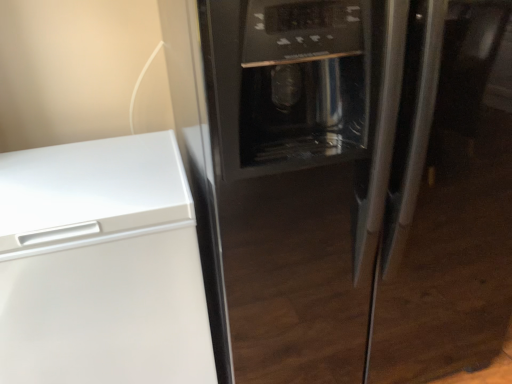
You are a GUI agent. You are given a task and a screenshot of the screen. Output one action in this format:
    pyautogui.click(x=<x>, y=<y>)
    Task: Click on the black glass refrigerator at center
    
    Given the screenshot: What is the action you would take?
    pyautogui.click(x=347, y=182)

What do you see at coordinates (347, 182) in the screenshot? Image resolution: width=512 pixels, height=384 pixels. I see `black glass refrigerator at center` at bounding box center [347, 182].

This screenshot has width=512, height=384. What do you see at coordinates (101, 266) in the screenshot? I see `white matte freezer at left` at bounding box center [101, 266].

Where is `white matte freezer at left`? Image resolution: width=512 pixels, height=384 pixels. white matte freezer at left is located at coordinates (101, 266).

Identify the location of black glass refrigerator at center. (347, 182).

In the image, is black glass refrigerator at center on the left side or the right side of white matte freezer at left?

Clearly, black glass refrigerator at center is on the right of white matte freezer at left in the image.

Which object is further away from the camera taking this photo, black glass refrigerator at center or white matte freezer at left?

white matte freezer at left is behind.

Does point (359, 61) lie in front of point (163, 136)?

Yes.

From the image's perspective, which one is positioned lower, black glass refrigerator at center or white matte freezer at left?

white matte freezer at left.

From a real-world perspective, is black glass refrigerator at center located beneath white matte freezer at left?

Incorrect, from a real-world perspective, black glass refrigerator at center is higher than white matte freezer at left.

Considering the sizes of objects black glass refrigerator at center and white matte freezer at left in the image provided, who is wider, black glass refrigerator at center or white matte freezer at left?

black glass refrigerator at center is wider.

Considering the sizes of black glass refrigerator at center and white matte freezer at left in the image, is black glass refrigerator at center taller or shorter than white matte freezer at left?

Clearly, black glass refrigerator at center is taller compared to white matte freezer at left.

Which of these two, black glass refrigerator at center or white matte freezer at left, is smaller?

white matte freezer at left.

Looking at this image, is black glass refrigerator at center surrounding white matte freezer at left?

No, black glass refrigerator at center does not contain white matte freezer at left.

Are black glass refrigerator at center and white matte freezer at left far apart?

No, black glass refrigerator at center is in close proximity to white matte freezer at left.

Is black glass refrigerator at center oriented towards white matte freezer at left?

No, black glass refrigerator at center is not facing towards white matte freezer at left.

This screenshot has width=512, height=384. I want to click on refrigerator to the right of white matte freezer at left, so click(347, 182).

Does white matte freezer at left appear on the left side of black glass refrigerator at center?

Correct, you'll find white matte freezer at left to the left of black glass refrigerator at center.

Which object is further away from the camera taking this photo, white matte freezer at left or black glass refrigerator at center?

white matte freezer at left.

Which is in front, point (170, 314) or point (229, 53)?

The point (229, 53) is closer.

From the image's perspective, between white matte freezer at left and black glass refrigerator at center, which one is located above?

black glass refrigerator at center appears higher in the image.

Consider the image. From a real-world perspective, does white matte freezer at left stand above black glass refrigerator at center?

No.

In terms of width, does white matte freezer at left look wider or thinner when compared to black glass refrigerator at center?

white matte freezer at left is thinner than black glass refrigerator at center.

Which of these two, white matte freezer at left or black glass refrigerator at center, stands taller?

With more height is black glass refrigerator at center.

Which of these two, white matte freezer at left or black glass refrigerator at center, is smaller?

Smaller between the two is white matte freezer at left.

Is white matte freezer at left outside of black glass refrigerator at center?

white matte freezer at left is positioned outside black glass refrigerator at center.

Is white matte freezer at left far from black glass refrigerator at center?

No, there isn't a large distance between white matte freezer at left and black glass refrigerator at center.

Is white matte freezer at left facing towards black glass refrigerator at center?

No, white matte freezer at left is not facing towards black glass refrigerator at center.

This screenshot has height=384, width=512. Identify the location of refrigerator above the white matte freezer at left (from a real-world perspective). (347, 182).

Where is `refrigerator above the white matte freezer at left (from the image's perspective)`? The image size is (512, 384). refrigerator above the white matte freezer at left (from the image's perspective) is located at coordinates (347, 182).

Where is `home appliance behind the black glass refrigerator at center`? The height and width of the screenshot is (384, 512). home appliance behind the black glass refrigerator at center is located at coordinates (101, 266).